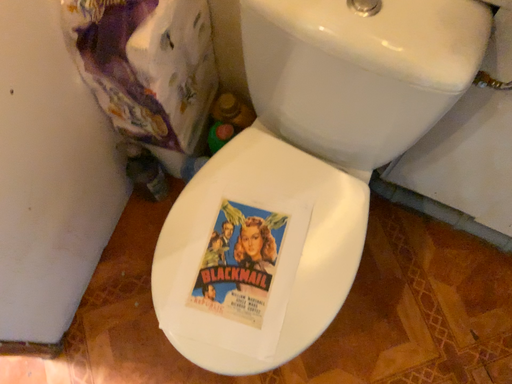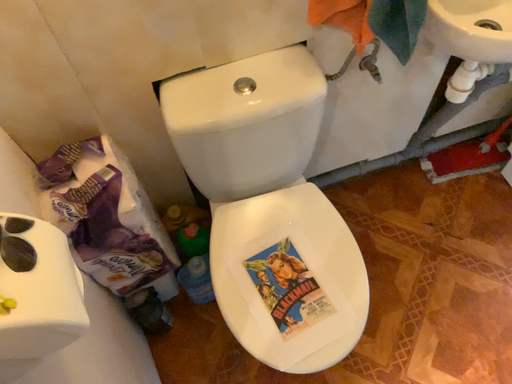
Question: Which way did the camera rotate in the video?

Choices:
 (A) rotated upward
 (B) rotated downward

Answer: (A)